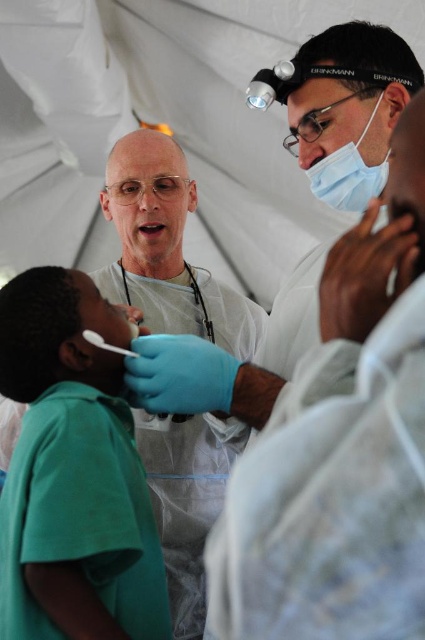
Question: Which of the following is the farthest from the observer?

Choices:
 (A) (87, 397)
 (B) (348, 147)

Answer: (B)

Question: Which point is farther to the camera?

Choices:
 (A) black rubber stethoscope at center
 (B) green matte shirt at lower left

Answer: (A)

Question: Estimate the real-world distances between objects in this image. Which object is closer to the black rubber stethoscope at center?

Choices:
 (A) green matte shirt at lower left
 (B) white matte gloves at center

Answer: (B)

Question: Can you confirm if white matte gloves at center is wider than black rubber stethoscope at center?

Choices:
 (A) no
 (B) yes

Answer: (B)

Question: Is matte white mask at upper center positioned behind black rubber stethoscope at center?

Choices:
 (A) no
 (B) yes

Answer: (A)

Question: Is white matte gloves at center below matte white mask at upper center?

Choices:
 (A) yes
 (B) no

Answer: (A)